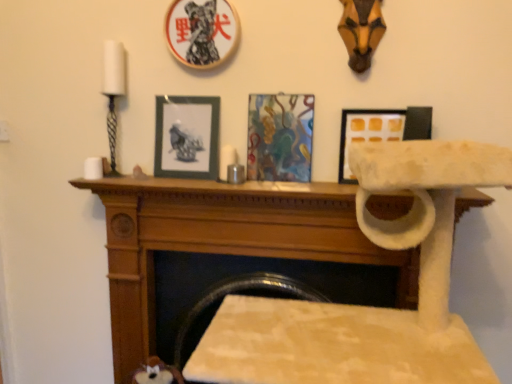
Question: In terms of width, does abstract painting at center, the 3th picture frame from the left, look wider or thinner when compared to white matte picture frame at upper center, arranged as the first picture frame when viewed from the right?

Choices:
 (A) thin
 (B) wide

Answer: (A)

Question: From their relative heights in the image, would you say abstract painting at center, the second picture frame when ordered from right to left, is taller or shorter than white matte picture frame at upper center, the 4th picture frame positioned from the left?

Choices:
 (A) short
 (B) tall

Answer: (B)

Question: Which object is positioned farthest from the abstract painting at center, the 3th picture frame from the left?

Choices:
 (A) white matte picture frame at upper center, the 4th picture frame positioned from the left
 (B) white felt cat tree at center
 (C) wooden picture frame at upper center, the third picture frame viewed from the right
 (D) wooden mantle at center
 (E) blue-gray matte picture frame at center, arranged as the fourth picture frame when viewed from the right

Answer: (C)

Question: Estimate the real-world distances between objects in this image. Which object is closer to the abstract painting at center, the 3th picture frame from the left?

Choices:
 (A) wooden picture frame at upper center, the third picture frame viewed from the right
 (B) white matte picture frame at upper center, the 4th picture frame positioned from the left
 (C) blue-gray matte picture frame at center, which is counted as the first picture frame, starting from the left
 (D) white felt cat tree at center
 (E) wooden mantle at center

Answer: (B)